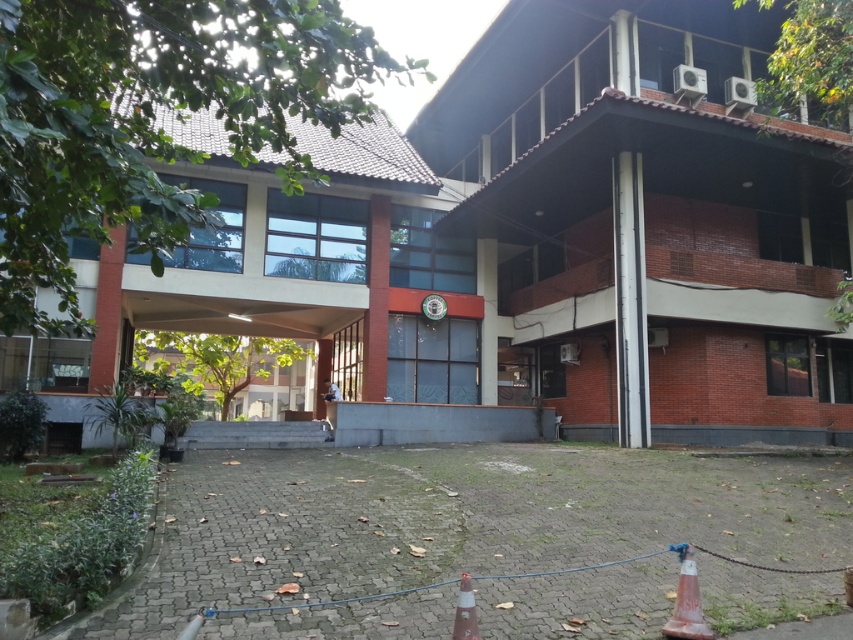
Looking at this image, which is below, red brick building at center or orange plastic traffic cone at lower center?

orange plastic traffic cone at lower center

Looking at this image, can you confirm if red brick building at center is thinner than orange plastic traffic cone at lower center?

No, red brick building at center is not thinner than orange plastic traffic cone at lower center.

What are the coordinates of `red brick building at center` in the screenshot? It's located at tap(544, 237).

Which is below, red brick building at center or orange reflective cone at lower right?

orange reflective cone at lower right

Does red brick building at center appear under orange reflective cone at lower right?

Actually, red brick building at center is above orange reflective cone at lower right.

Locate an element on the screen. This screenshot has height=640, width=853. red brick building at center is located at coordinates (544, 237).

What do you see at coordinates (544, 237) in the screenshot?
I see `red brick building at center` at bounding box center [544, 237].

Who is taller, red brick building at center or matte brick building at center?

matte brick building at center

Who is more distant from viewer, (643, 276) or (39, 353)?

Positioned behind is point (39, 353).

I want to click on red brick building at center, so click(544, 237).